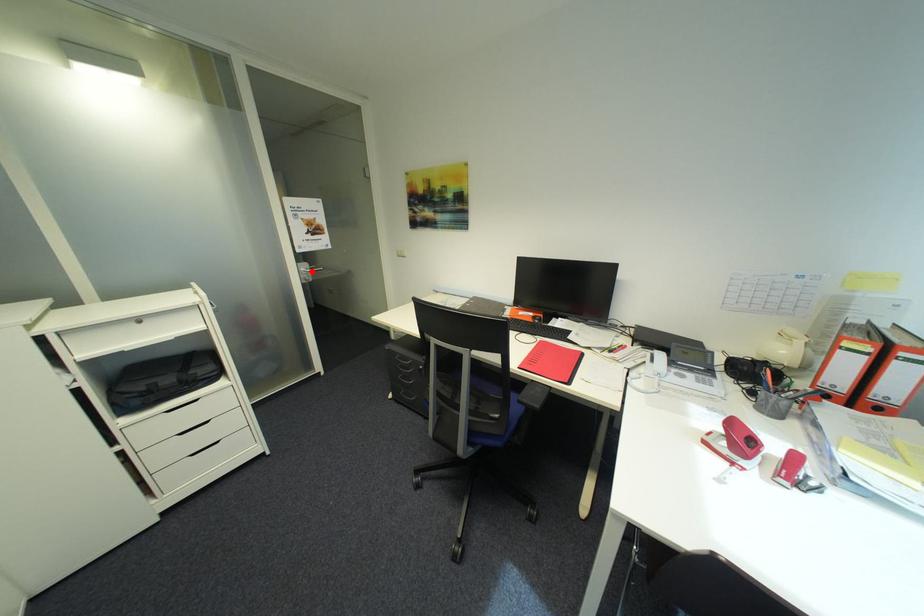
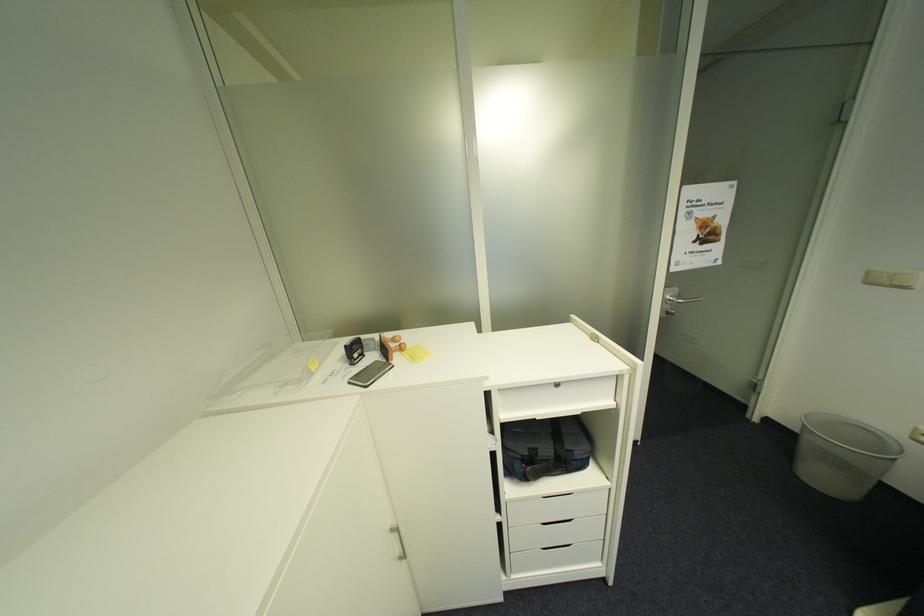
Question: I am providing you with two images of the same scene from different viewpoints. In image1, a red point is highlighted. Considering the same 3D point in image2, which of the following is correct?

Choices:
 (A) It is closer
 (B) It is farther

Answer: (B)